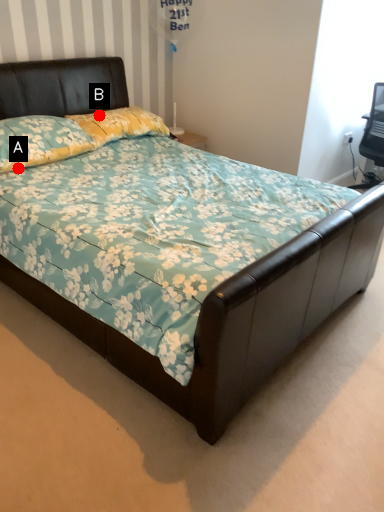
Question: Two points are circled on the image, labeled by A and B beside each circle. Which of the following is the farthest from the observer?

Choices:
 (A) A is further
 (B) B is further

Answer: (B)